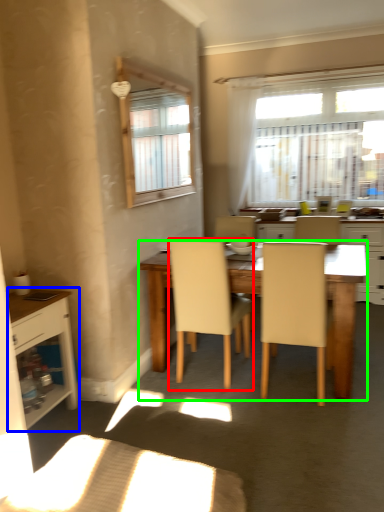
Question: Based on their relative distances, which object is nearer to chair (highlighted by a red box)? Choose from cabinetry (highlighted by a blue box) and desk (highlighted by a green box).

Choices:
 (A) cabinetry
 (B) desk

Answer: (B)